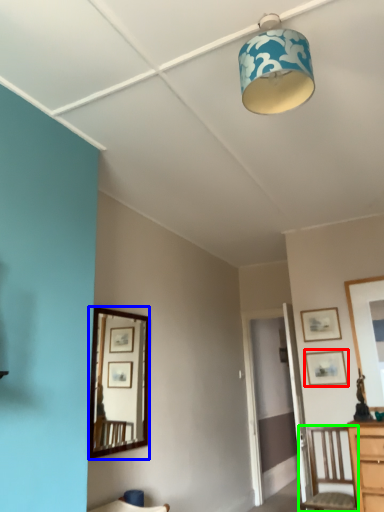
Question: Considering the real-world distances, which object is farthest from picture frame (highlighted by a red box)? mirror (highlighted by a blue box) or chair (highlighted by a green box)?

Choices:
 (A) mirror
 (B) chair

Answer: (A)